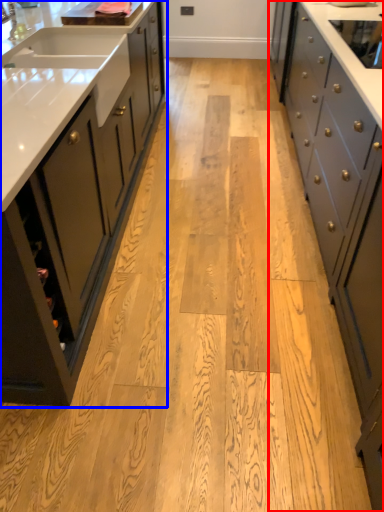
Question: Which of the following is the closest to the observer, cabinetry (highlighted by a red box) or cabinetry (highlighted by a blue box)?

Choices:
 (A) cabinetry
 (B) cabinetry

Answer: (A)